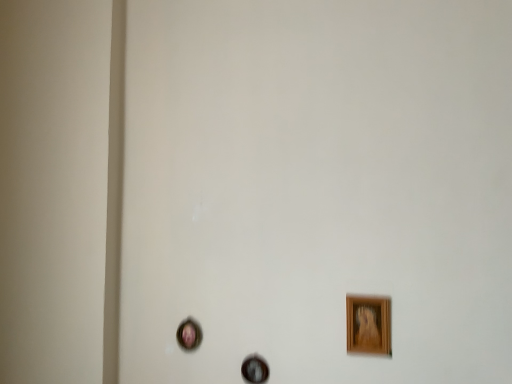
In order to face matte pink picture frame at lower left, the 3th picture frame positioned from the right, should I rotate leftwards or rightwards?

A 9.276 degree turn to the left will do.

Locate an element on the screen. Image resolution: width=512 pixels, height=384 pixels. wooden picture frame at center, which is counted as the 2th picture frame, starting from the left is located at coordinates (255, 370).

Is matte pink picture frame at lower left, the first picture frame when ordered from left to right, positioned with its back to wooden picture frame at center, which is counted as the 2th picture frame, starting from the left?

No.

In the scene shown: Is matte pink picture frame at lower left, positioned as the third picture frame in front-to-back order, positioned beyond the bounds of wooden picture frame at center, which is counted as the 2th picture frame, starting from the left?

Absolutely, matte pink picture frame at lower left, positioned as the third picture frame in front-to-back order, is external to wooden picture frame at center, which is counted as the 2th picture frame, starting from the left.

Is matte pink picture frame at lower left, which is counted as the first picture frame, starting from the back, wider or thinner than wooden picture frame at center, which is counted as the 2th picture frame, starting from the left?

matte pink picture frame at lower left, which is counted as the first picture frame, starting from the back, is wider than wooden picture frame at center, which is counted as the 2th picture frame, starting from the left.

Considering the sizes of objects matte pink picture frame at lower left, the 3th picture frame positioned from the right, and wooden picture frame at center, which is counted as the 2th picture frame, starting from the left, in the image provided, who is bigger, matte pink picture frame at lower left, the 3th picture frame positioned from the right, or wooden picture frame at center, which is counted as the 2th picture frame, starting from the left,?

matte pink picture frame at lower left, the 3th picture frame positioned from the right, is bigger.

Considering the positions of objects wooden picture frame at center, the second picture frame in the right-to-left sequence, and matte pink picture frame at lower left, positioned as the third picture frame in front-to-back order, in the image provided, who is behind, wooden picture frame at center, the second picture frame in the right-to-left sequence, or matte pink picture frame at lower left, positioned as the third picture frame in front-to-back order,?

Positioned behind is matte pink picture frame at lower left, positioned as the third picture frame in front-to-back order.

Is there a large distance between wooden picture frame at center, which is counted as the 2th picture frame, starting from the left, and matte pink picture frame at lower left, positioned as the third picture frame in front-to-back order?

No, wooden picture frame at center, which is counted as the 2th picture frame, starting from the left, is not far from matte pink picture frame at lower left, positioned as the third picture frame in front-to-back order.

From a real-world perspective, who is located higher, wooden picture frame at center, the 2th picture frame from the front, or matte pink picture frame at lower left, which is counted as the first picture frame, starting from the back?

matte pink picture frame at lower left, which is counted as the first picture frame, starting from the back, from a real-world perspective.

Does wooden picture frame at lower right, which is counted as the first picture frame, starting from the right, have a greater height compared to matte pink picture frame at lower left, positioned as the third picture frame in front-to-back order?

Yes.

Considering the positions of objects wooden picture frame at lower right, placed as the 1th picture frame when sorted from front to back, and matte pink picture frame at lower left, positioned as the third picture frame in front-to-back order, in the image provided, who is more to the right, wooden picture frame at lower right, placed as the 1th picture frame when sorted from front to back, or matte pink picture frame at lower left, positioned as the third picture frame in front-to-back order,?

Positioned to the right is wooden picture frame at lower right, placed as the 1th picture frame when sorted from front to back.

From the image's perspective, is wooden picture frame at lower right, which is counted as the first picture frame, starting from the right, located above matte pink picture frame at lower left, positioned as the third picture frame in front-to-back order?

Yes, from the image's perspective, wooden picture frame at lower right, which is counted as the first picture frame, starting from the right, is over matte pink picture frame at lower left, positioned as the third picture frame in front-to-back order.

Considering the sizes of wooden picture frame at lower right, placed as the 1th picture frame when sorted from front to back, and matte pink picture frame at lower left, the 3th picture frame positioned from the right, in the image, is wooden picture frame at lower right, placed as the 1th picture frame when sorted from front to back, bigger or smaller than matte pink picture frame at lower left, the 3th picture frame positioned from the right,?

Clearly, wooden picture frame at lower right, placed as the 1th picture frame when sorted from front to back, is larger in size than matte pink picture frame at lower left, the 3th picture frame positioned from the right.

Considering the relative sizes of wooden picture frame at center, the 2th picture frame from the front, and wooden picture frame at lower right, the third picture frame in the back-to-front sequence, in the image provided, is wooden picture frame at center, the 2th picture frame from the front, wider than wooden picture frame at lower right, the third picture frame in the back-to-front sequence,?

In fact, wooden picture frame at center, the 2th picture frame from the front, might be narrower than wooden picture frame at lower right, the third picture frame in the back-to-front sequence.

From the image's perspective, is wooden picture frame at center, the second picture frame in the right-to-left sequence, on top of wooden picture frame at lower right, positioned as the 3th picture frame in left-to-right order?

Incorrect, from the image's perspective, wooden picture frame at center, the second picture frame in the right-to-left sequence, is lower than wooden picture frame at lower right, positioned as the 3th picture frame in left-to-right order.

This screenshot has height=384, width=512. Find the location of `picture frame located on the right of wooden picture frame at center, which is the 2th picture frame in back-to-front order`. picture frame located on the right of wooden picture frame at center, which is the 2th picture frame in back-to-front order is located at coordinates (368, 325).

Would you say wooden picture frame at center, the second picture frame in the right-to-left sequence, is outside wooden picture frame at lower right, which is counted as the first picture frame, starting from the right?

Yes, wooden picture frame at center, the second picture frame in the right-to-left sequence, is not within wooden picture frame at lower right, which is counted as the first picture frame, starting from the right.

Is wooden picture frame at lower right, placed as the 1th picture frame when sorted from front to back, oriented towards wooden picture frame at center, which is counted as the 2th picture frame, starting from the left?

No.

From a real-world perspective, is wooden picture frame at lower right, which is counted as the first picture frame, starting from the right, physically located above or below wooden picture frame at center, which is the 2th picture frame in back-to-front order?

From a real-world perspective, wooden picture frame at lower right, which is counted as the first picture frame, starting from the right, is physically above wooden picture frame at center, which is the 2th picture frame in back-to-front order.

Is wooden picture frame at lower right, which is counted as the first picture frame, starting from the right, behind wooden picture frame at center, the second picture frame in the right-to-left sequence?

No, wooden picture frame at lower right, which is counted as the first picture frame, starting from the right, is closer to the camera.

Is wooden picture frame at lower right, placed as the 1th picture frame when sorted from front to back, completely or partially inside matte pink picture frame at lower left, the first picture frame when ordered from left to right?

No, wooden picture frame at lower right, placed as the 1th picture frame when sorted from front to back, is not a part of matte pink picture frame at lower left, the first picture frame when ordered from left to right.

Considering the sizes of objects matte pink picture frame at lower left, which is counted as the first picture frame, starting from the back, and wooden picture frame at lower right, the third picture frame in the back-to-front sequence, in the image provided, who is taller, matte pink picture frame at lower left, which is counted as the first picture frame, starting from the back, or wooden picture frame at lower right, the third picture frame in the back-to-front sequence,?

wooden picture frame at lower right, the third picture frame in the back-to-front sequence.

From the picture: Does matte pink picture frame at lower left, the first picture frame when ordered from left to right, touch wooden picture frame at lower right, the third picture frame in the back-to-front sequence?

No, matte pink picture frame at lower left, the first picture frame when ordered from left to right, is not beside wooden picture frame at lower right, the third picture frame in the back-to-front sequence.

This screenshot has height=384, width=512. In order to click on picture frame that is the 1st one when counting forward from the matte pink picture frame at lower left, positioned as the third picture frame in front-to-back order in this screenshot , I will do `click(255, 370)`.

This screenshot has width=512, height=384. In order to click on the 1st picture frame directly above the wooden picture frame at center, which is the 2th picture frame in back-to-front order (from a real-world perspective) in this screenshot , I will do `click(189, 334)`.

From the image, which object appears to be nearer to wooden picture frame at center, the second picture frame in the right-to-left sequence, matte pink picture frame at lower left, which is counted as the first picture frame, starting from the back, or wooden picture frame at lower right, positioned as the 3th picture frame in left-to-right order?

The object closer to wooden picture frame at center, the second picture frame in the right-to-left sequence, is matte pink picture frame at lower left, which is counted as the first picture frame, starting from the back.

Considering their positions, is wooden picture frame at center, which is counted as the 2th picture frame, starting from the left, positioned closer to wooden picture frame at lower right, the third picture frame in the back-to-front sequence, than matte pink picture frame at lower left, which is counted as the first picture frame, starting from the back?

wooden picture frame at center, which is counted as the 2th picture frame, starting from the left, is closer to wooden picture frame at lower right, the third picture frame in the back-to-front sequence.

Based on their spatial positions, is wooden picture frame at lower right, placed as the 1th picture frame when sorted from front to back, or wooden picture frame at center, which is counted as the 2th picture frame, starting from the left, further from matte pink picture frame at lower left, the first picture frame when ordered from left to right?

wooden picture frame at lower right, placed as the 1th picture frame when sorted from front to back, lies further to matte pink picture frame at lower left, the first picture frame when ordered from left to right, than the other object.

When comparing their distances from wooden picture frame at center, the second picture frame in the right-to-left sequence, does wooden picture frame at lower right, the third picture frame in the back-to-front sequence, or matte pink picture frame at lower left, which is counted as the first picture frame, starting from the back, seem closer?

Among the two, matte pink picture frame at lower left, which is counted as the first picture frame, starting from the back, is located nearer to wooden picture frame at center, the second picture frame in the right-to-left sequence.

When comparing their distances from wooden picture frame at lower right, the third picture frame in the back-to-front sequence, does matte pink picture frame at lower left, the first picture frame when ordered from left to right, or wooden picture frame at center, the second picture frame in the right-to-left sequence, seem further?

The object further to wooden picture frame at lower right, the third picture frame in the back-to-front sequence, is matte pink picture frame at lower left, the first picture frame when ordered from left to right.

When comparing their distances from matte pink picture frame at lower left, which is counted as the first picture frame, starting from the back, does wooden picture frame at center, which is counted as the 2th picture frame, starting from the left, or wooden picture frame at lower right, the third picture frame in the back-to-front sequence, seem closer?

Based on the image, wooden picture frame at center, which is counted as the 2th picture frame, starting from the left, appears to be nearer to matte pink picture frame at lower left, which is counted as the first picture frame, starting from the back.

Where is `picture frame between matte pink picture frame at lower left, which is counted as the first picture frame, starting from the back, and wooden picture frame at lower right, placed as the 1th picture frame when sorted from front to back`? The image size is (512, 384). picture frame between matte pink picture frame at lower left, which is counted as the first picture frame, starting from the back, and wooden picture frame at lower right, placed as the 1th picture frame when sorted from front to back is located at coordinates (255, 370).